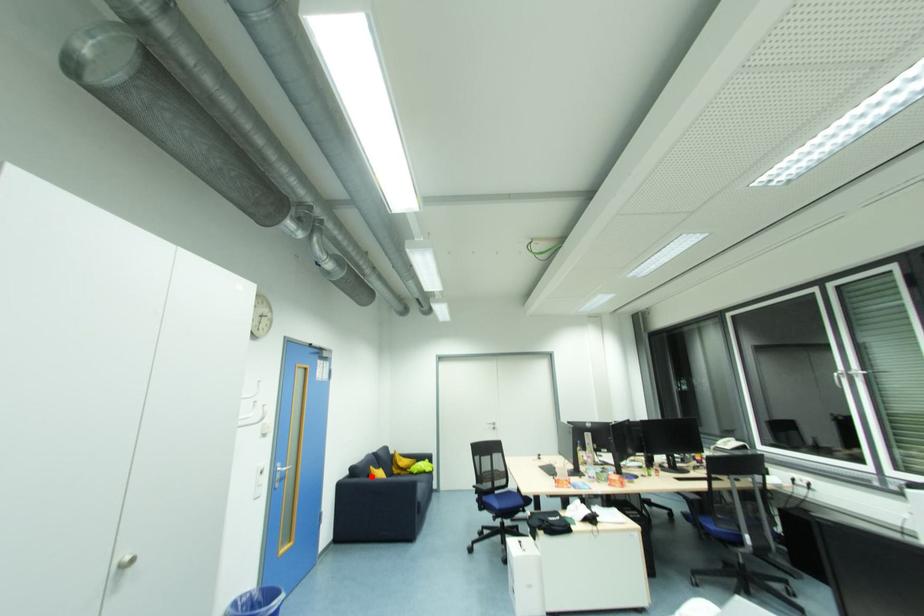
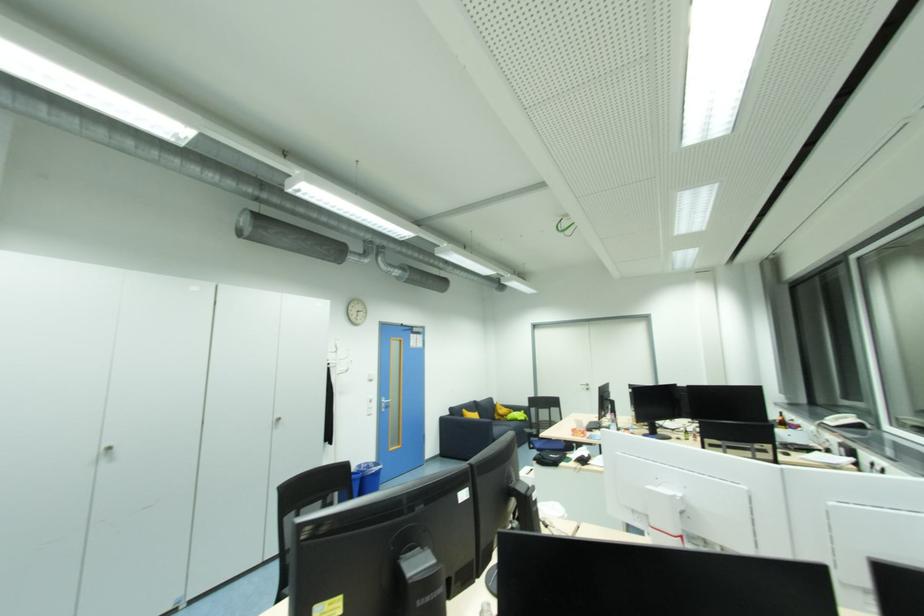
Locate, in the second image, the point that corresponds to the highlighted location in the first image.

(466, 416)